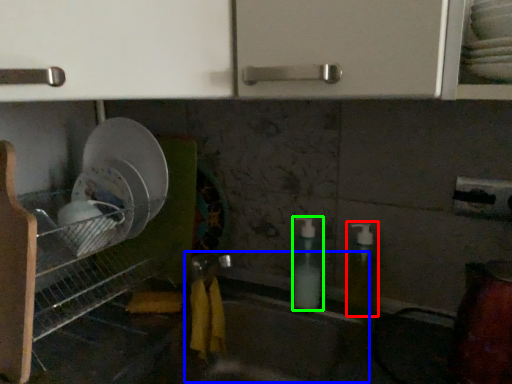
Question: Considering the real-world distances, which object is farthest from soap dispenser (highlighted by a red box)? sink (highlighted by a blue box) or soap dispenser (highlighted by a green box)?

Choices:
 (A) sink
 (B) soap dispenser

Answer: (A)